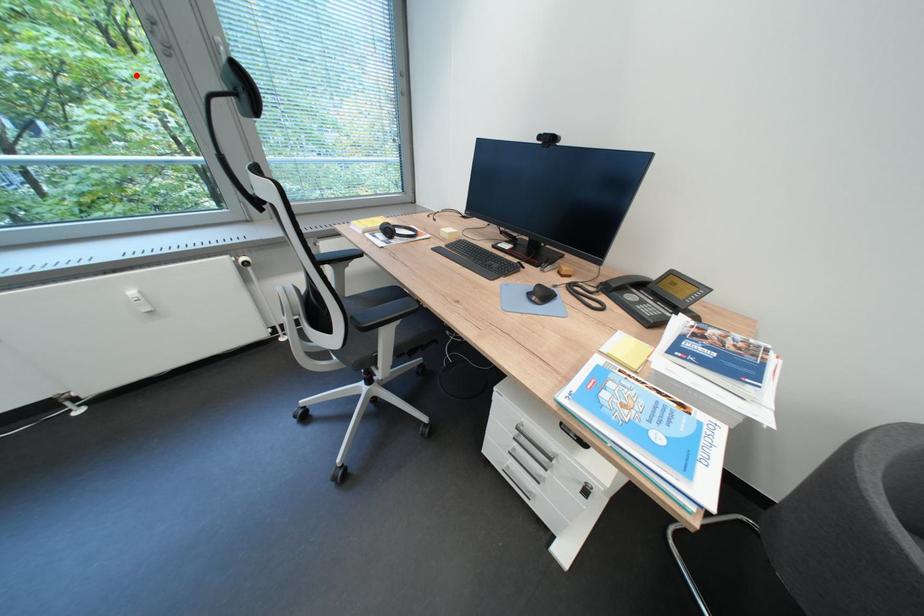
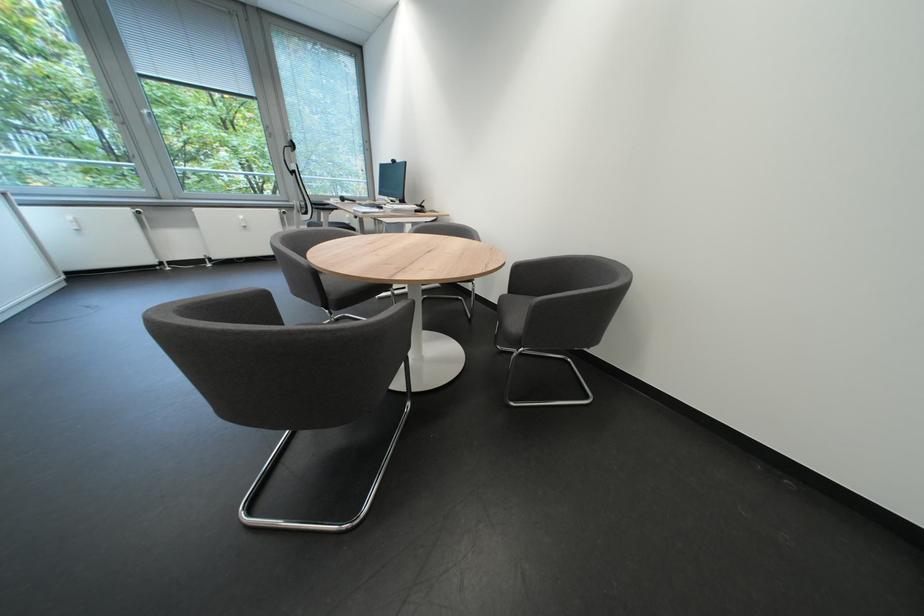
Question: I am providing you with two images of the same scene from different viewpoints. In image1, a red point is highlighted. Considering the same 3D point in image2, which of the following is correct?

Choices:
 (A) It is closer
 (B) It is farther

Answer: (A)